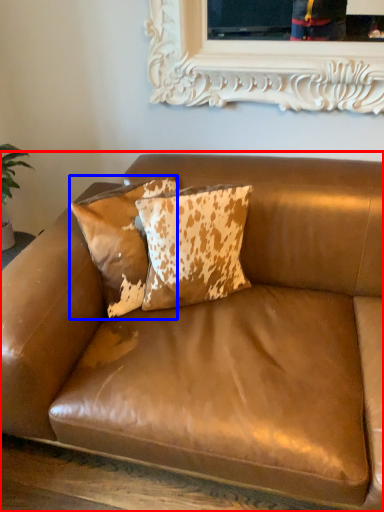
Question: Which of the following is the closest to the observer, studio couch (highlighted by a red box) or pillow (highlighted by a blue box)?

Choices:
 (A) studio couch
 (B) pillow

Answer: (A)